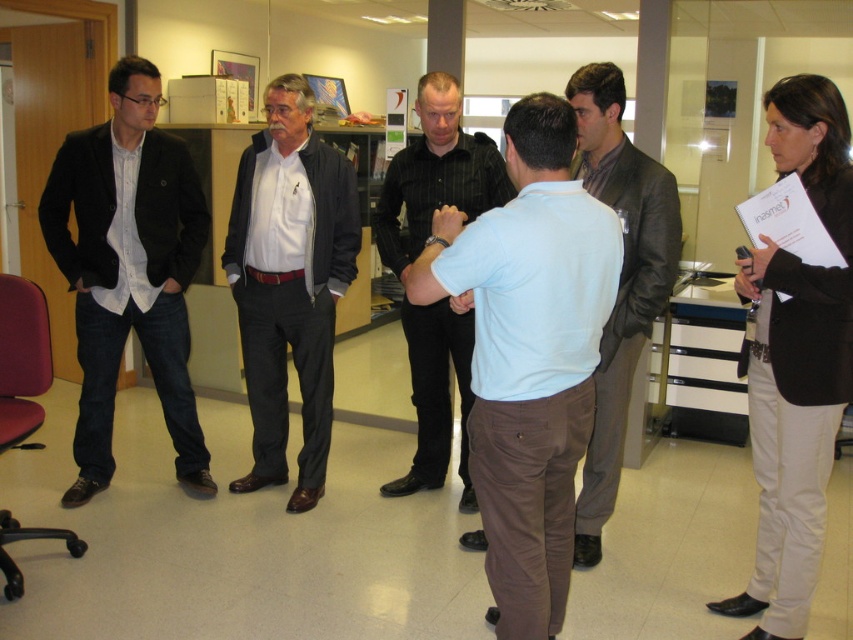
Question: Is black striped shirt at center wider than dark brown leather jacket at center?

Choices:
 (A) yes
 (B) no

Answer: (A)

Question: Which of the following is the farthest from the observer?

Choices:
 (A) (276, 266)
 (B) (583, 141)
 (C) (422, 240)

Answer: (A)

Question: Which is nearer to the dark brown leather jacket at center?

Choices:
 (A) dark blue denim jeans at left
 (B) white matte shirt at center

Answer: (B)

Question: Can you confirm if dark blue denim jeans at left is wider than white matte shirt at center?

Choices:
 (A) yes
 (B) no

Answer: (A)

Question: Is dark blue denim jeans at left wider than white matte shirt at center?

Choices:
 (A) no
 (B) yes

Answer: (B)

Question: Which object appears farthest from the camera in this image?

Choices:
 (A) dark blue denim jeans at left
 (B) dark brown leather jacket at center
 (C) white matte shirt at center

Answer: (A)